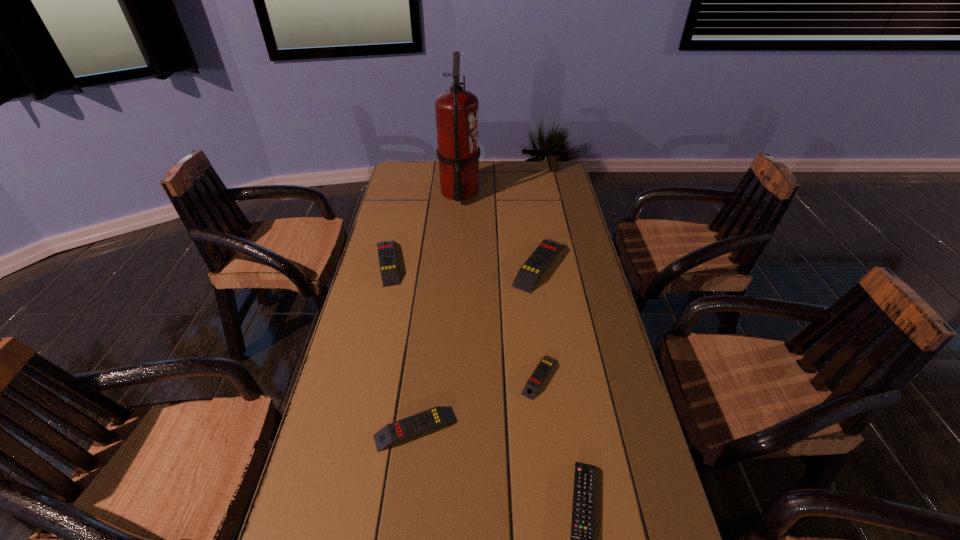
Locate an element on the screen. The height and width of the screenshot is (540, 960). the second nearest yellow remote control is located at coordinates (539, 375).

The width and height of the screenshot is (960, 540). Find the location of `the fifth farthest object`. the fifth farthest object is located at coordinates (539, 375).

Find the location of a particular element. vacant space located toward the nozzle of the tallest object is located at coordinates (507, 192).

I want to click on vacant space located 0.400m at the muzzle of the pistol, so click(x=429, y=171).

At what (x,y) coordinates should I click in order to perform the action: click on vacant region located at the muzzle of the pistol. Please return your answer as a coordinate pair (x, y). Looking at the image, I should click on (457, 171).

Identify the location of vacant space located at the muzzle of the pistol. (482, 171).

Find the location of `vacant position located on the front of the fifth shortest object`. vacant position located on the front of the fifth shortest object is located at coordinates (561, 391).

You are a GUI agent. You are given a task and a screenshot of the screen. Output one action in this format:
    pyautogui.click(x=<x>, y=<y>)
    Task: Click on the free space located on the front of the leftmost remote control
    
    Given the screenshot: What is the action you would take?
    pyautogui.click(x=362, y=372)

Find the location of a particular element. The width and height of the screenshot is (960, 540). free space located on the front of the second nearest remote control is located at coordinates (410, 484).

I want to click on vacant position located on the back of the smallest yellow remote control, so click(x=536, y=341).